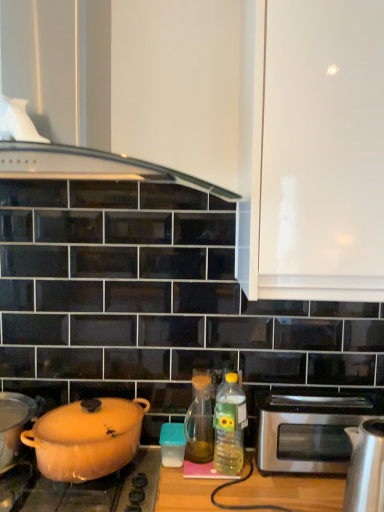
Question: Would you say matte orange pot at lower left is inside or outside matte orange pot at left, which is the 5th kitchen appliance from right to left?

Choices:
 (A) inside
 (B) outside

Answer: (B)

Question: From their relative heights in the image, would you say matte orange pot at lower left is taller or shorter than matte orange pot at left, which is the 5th kitchen appliance from right to left?

Choices:
 (A) short
 (B) tall

Answer: (A)

Question: Which object is positioned closest to the translucent amber glass at center, the 2th bottle when ordered from right to left?

Choices:
 (A) white glossy cabinet at upper right
 (B) satin silver kettle at right, marked as the fourth kitchen appliance in a top-to-bottom arrangement
 (C) matte orange pot at lower left, which ranks as the 4th kitchen appliance in bottom-to-top order
 (D) stainless steel toaster at right
 (E) translucent plastic bottle at center, the 1th bottle when ordered from right to left

Answer: (E)

Question: Based on their relative distances, which object is nearer to the stainless steel toaster at right?

Choices:
 (A) translucent plastic container at center, acting as the second kitchen appliance starting from the right
 (B) matte orange pot at lower left
 (C) translucent amber glass at center, which is counted as the first bottle, starting from the left
 (D) translucent plastic bottle at center, the 1th bottle when ordered from right to left
 (E) white glossy vase at upper left, acting as the 4th kitchen appliance starting from the right

Answer: (D)